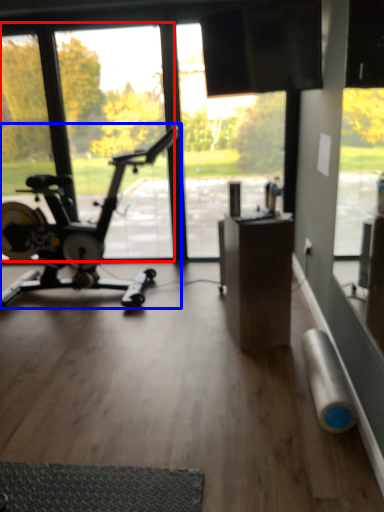
Question: Which object appears closest to the camera in this image, window screen (highlighted by a red box) or stationary bicycle (highlighted by a blue box)?

Choices:
 (A) window screen
 (B) stationary bicycle

Answer: (B)